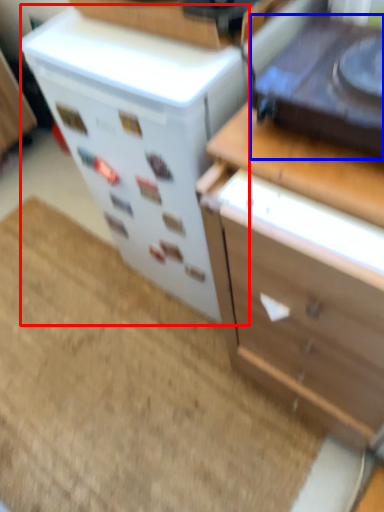
Question: Which point is closer to the camera, appliance (highlighted by a red box) or appliance (highlighted by a blue box)?

Choices:
 (A) appliance
 (B) appliance

Answer: (B)